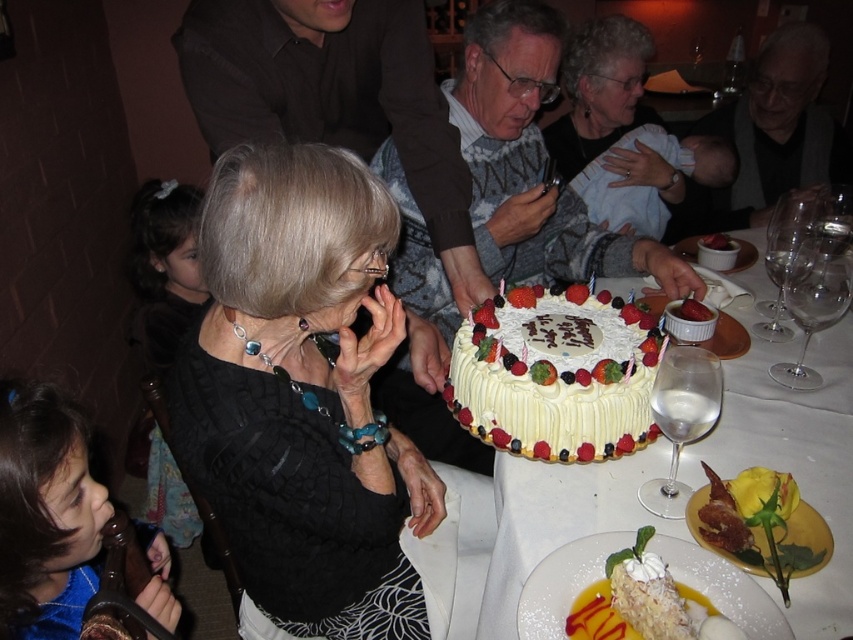
Question: Does white frosted cake at center have a smaller size compared to powdered sugar cake at center?

Choices:
 (A) no
 (B) yes

Answer: (A)

Question: Considering the real-world distances, which object is farthest from the black matte sweater at center?

Choices:
 (A) powdered sugar cake at center
 (B) white frosted cake at center
 (C) blue velvet dress at center

Answer: (B)

Question: Is gray sweater at center thinner than powdered sugar cake at center?

Choices:
 (A) yes
 (B) no

Answer: (B)

Question: Observing the image, what is the correct spatial positioning of black matte sweater at center in reference to blue velvet dress at center?

Choices:
 (A) below
 (B) above

Answer: (B)

Question: Which point is farther from the camera taking this photo?

Choices:
 (A) (614, 120)
 (B) (689, 224)
 (C) (474, 381)
 (D) (519, 97)

Answer: (B)

Question: Estimate the real-world distances between objects in this image. Which object is farther from the white frosted cake at center?

Choices:
 (A) blue velvet dress at center
 (B) matte black sweater at center
 (C) gray sweater at center

Answer: (B)